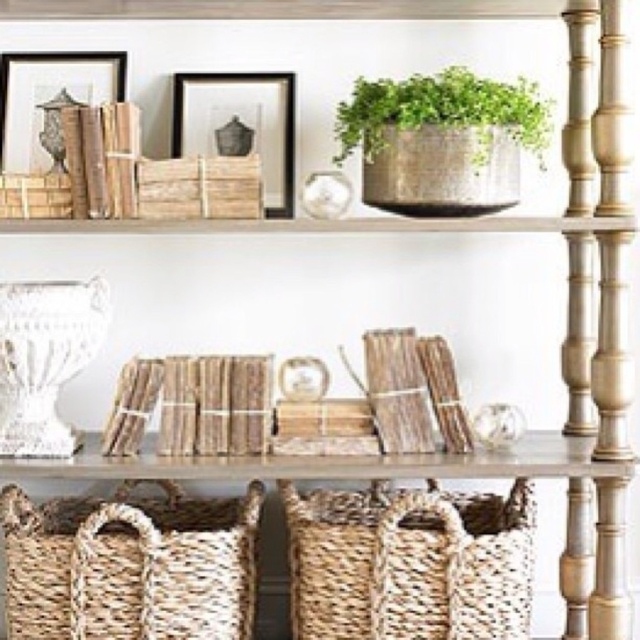
Which is above, woven natural basket at upper center or green woven basket at upper center?

green woven basket at upper center

What do you see at coordinates (440, 170) in the screenshot? I see `woven natural basket at upper center` at bounding box center [440, 170].

Does point (397, 209) come in front of point (371, 81)?

Yes.

Image resolution: width=640 pixels, height=640 pixels. Identify the location of woven natural basket at upper center. (440, 170).

How distant is natural woven basket at lower left from matte black picture frame at upper left?

natural woven basket at lower left and matte black picture frame at upper left are 93.40 centimeters apart from each other.

Is natural woven basket at lower left below matte black picture frame at upper left?

Correct, natural woven basket at lower left is located below matte black picture frame at upper left.

At what (x,y) coordinates should I click in order to perform the action: click on natural woven basket at lower left. Please return your answer as a coordinate pair (x, y). The width and height of the screenshot is (640, 640). Looking at the image, I should click on (129, 566).

Which of these two, woven natural basket at upper center or rustic wicker basket at upper left, stands taller?

Standing taller between the two is woven natural basket at upper center.

Does woven natural basket at upper center have a larger size compared to rustic wicker basket at upper left?

Yes.

Describe the element at coordinates (440, 170) in the screenshot. The image size is (640, 640). I see `woven natural basket at upper center` at that location.

Where is `woven natural basket at upper center`? The height and width of the screenshot is (640, 640). woven natural basket at upper center is located at coordinates click(440, 170).